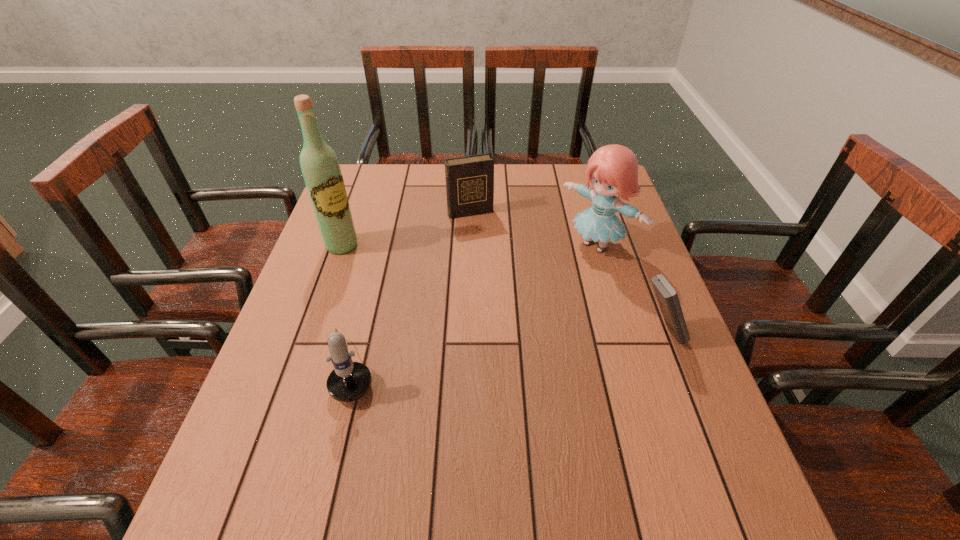
At what (x,y) coordinates should I click in order to perform the action: click on vacant space located on the front-facing side of the leftmost object. Please return your answer as a coordinate pair (x, y). Looking at the image, I should click on (391, 285).

Locate an element on the screen. free spot located on the front cover of the farthest object is located at coordinates (520, 315).

This screenshot has width=960, height=540. What are the coordinates of `free space located 0.180m on the front cover of the farthest object` in the screenshot? It's located at (493, 256).

This screenshot has width=960, height=540. I want to click on vacant space located on the front cover of the farthest object, so click(x=516, y=306).

Where is `free location located 0.220m on the front-facing side of the fourth shortest object`? free location located 0.220m on the front-facing side of the fourth shortest object is located at coordinates (524, 305).

The width and height of the screenshot is (960, 540). Identify the location of vacant region located 0.080m on the front-facing side of the fourth shortest object. (558, 276).

Identify the location of vacant space located on the front-facing side of the fourth shortest object. Image resolution: width=960 pixels, height=540 pixels. (561, 274).

The height and width of the screenshot is (540, 960). Identify the location of microphone situated at the left edge. (349, 381).

You are a GUI agent. You are given a task and a screenshot of the screen. Output one action in this format:
    pyautogui.click(x=<x>, y=<y>)
    Task: Click on the wine bottle that is at the left edge
    The width and height of the screenshot is (960, 540).
    Given the screenshot: What is the action you would take?
    pyautogui.click(x=320, y=167)

This screenshot has width=960, height=540. I want to click on calculator that is at the right edge, so click(667, 297).